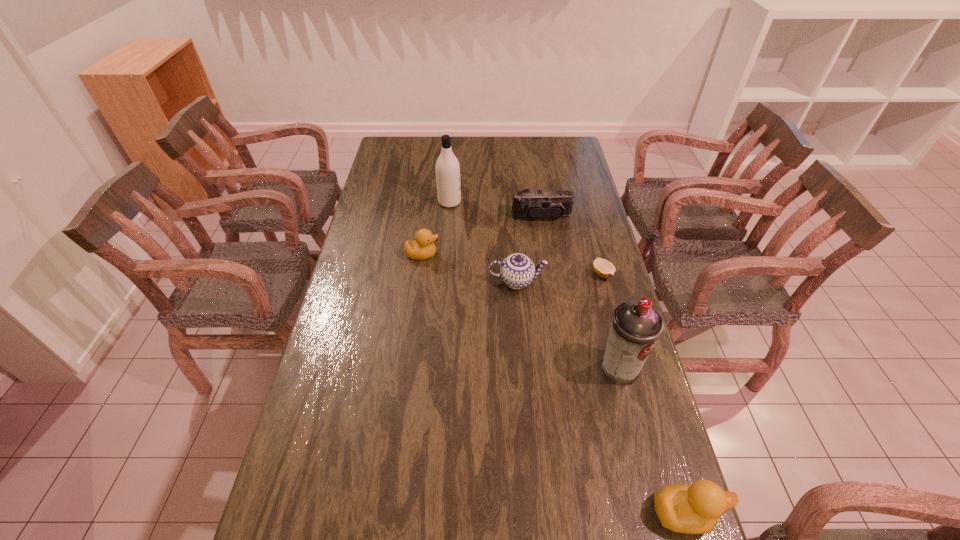
The height and width of the screenshot is (540, 960). Find the location of `vacant area that lies between the shampoo and the fifth nearest object`. vacant area that lies between the shampoo and the fifth nearest object is located at coordinates (436, 228).

You are a GUI agent. You are given a task and a screenshot of the screen. Output one action in this format:
    pyautogui.click(x=<x>, y=<y>)
    Task: Click on the free space between the camcorder and the third farthest object
    The width and height of the screenshot is (960, 540).
    Given the screenshot: What is the action you would take?
    pyautogui.click(x=482, y=235)

The image size is (960, 540). I want to click on free space between the camcorder and the chinaware, so click(x=529, y=248).

At what (x,y) coordinates should I click in order to perform the action: click on free point between the sixth nearest object and the sixth farthest object. Please return your answer as a coordinate pair (x, y). The height and width of the screenshot is (540, 960). Looking at the image, I should click on (580, 293).

The width and height of the screenshot is (960, 540). I want to click on object identified as the second closest to the chinaware, so click(x=422, y=248).

Find the location of a particular element. the third closest object to the left duckling is located at coordinates pyautogui.click(x=536, y=204).

Where is `vacant region that satisfies the following two spatial constraints: 1. on the front-facing side of the shampoo; 2. on the right side of the shortest object`? The height and width of the screenshot is (540, 960). vacant region that satisfies the following two spatial constraints: 1. on the front-facing side of the shampoo; 2. on the right side of the shortest object is located at coordinates (444, 274).

The image size is (960, 540). What are the coordinates of `vacant space that satisfies the following two spatial constraints: 1. on the front-facing side of the shampoo; 2. on the right side of the lemon` in the screenshot? It's located at (444, 274).

At what (x,y) coordinates should I click in order to perform the action: click on vacant space that satisfies the following two spatial constraints: 1. on the front-facing side of the farthest object; 2. on the right side of the shortest object. Please return your answer as a coordinate pair (x, y). The width and height of the screenshot is (960, 540). Looking at the image, I should click on (444, 274).

This screenshot has height=540, width=960. Identify the location of vacant area that satisfies the following two spatial constraints: 1. on the front-facing side of the shortest object; 2. on the right side of the camcorder. (550, 274).